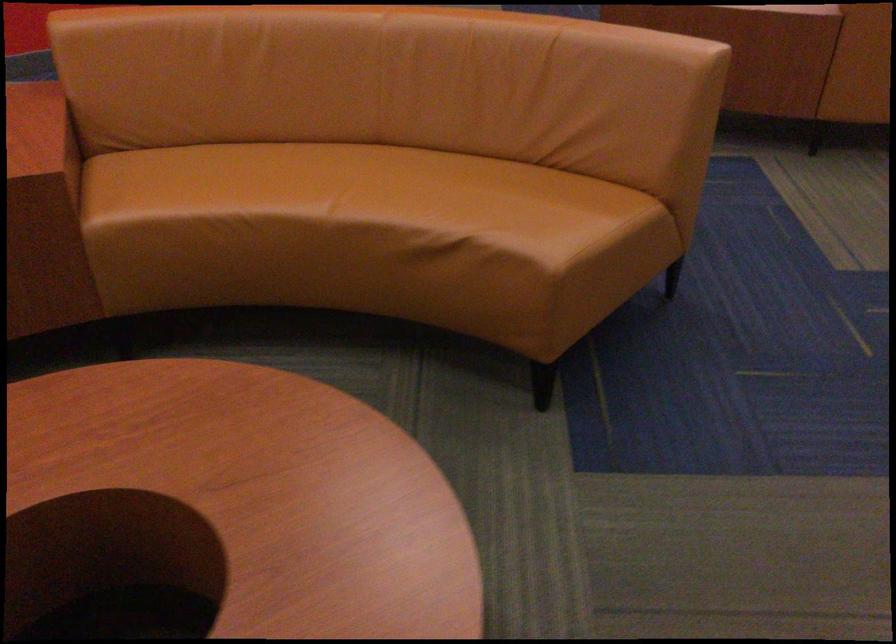
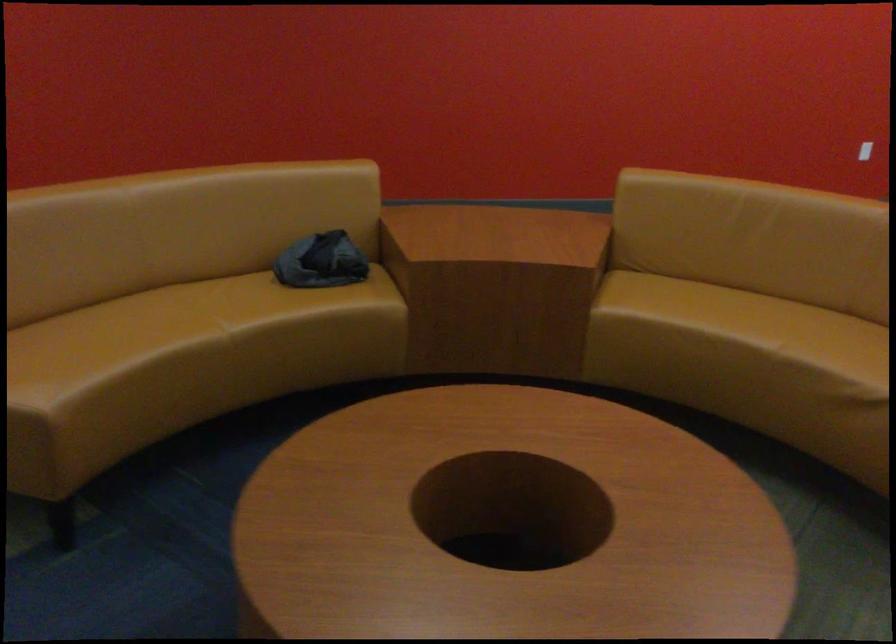
Question: Based on the continuous images, in which direction is the camera rotating? Reply with the corresponding letter.

Choices:
 (A) Left
 (B) Right
 (C) Up
 (D) Down

Answer: (A)